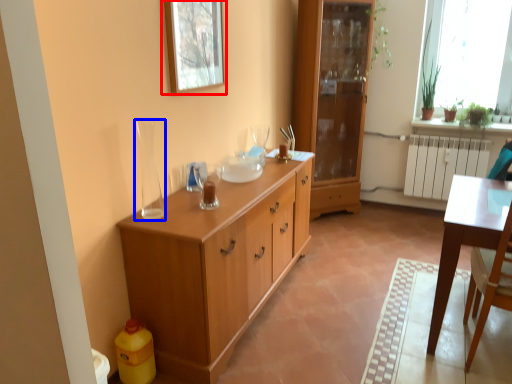
Question: Which object appears farthest to the camera in this image, picture frame (highlighted by a red box) or glass vase (highlighted by a blue box)?

Choices:
 (A) picture frame
 (B) glass vase

Answer: (A)